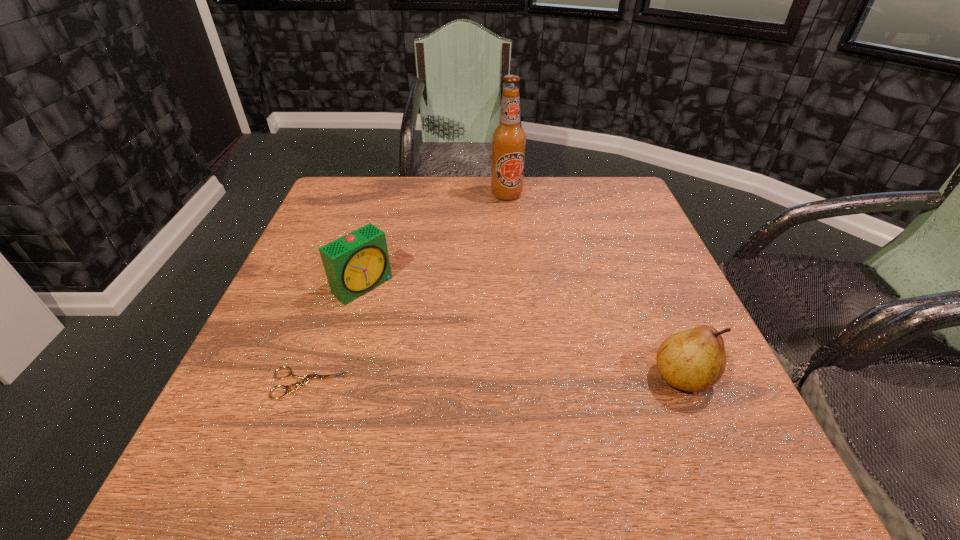
At what (x,y) coordinates should I click in order to perform the action: click on vacant area situated 0.230m on the front-facing side of the alarm clock. Please return your answer as a coordinate pair (x, y). Looking at the image, I should click on (453, 357).

In order to click on free space located 0.050m on the front-facing side of the alarm clock in this screenshot , I will do `click(394, 310)`.

Image resolution: width=960 pixels, height=540 pixels. In order to click on vacant space located 0.210m on the front-facing side of the alarm clock in this screenshot , I will do `click(446, 352)`.

Find the location of `object that is at the far edge`. object that is at the far edge is located at coordinates (508, 139).

Identify the location of shears present at the near edge. (305, 379).

Locate an element on the screen. The width and height of the screenshot is (960, 540). pear positioned at the near edge is located at coordinates (693, 360).

The height and width of the screenshot is (540, 960). What are the coordinates of `shears that is at the left edge` in the screenshot? It's located at (305, 379).

Where is `alarm clock that is at the left edge`? alarm clock that is at the left edge is located at coordinates (356, 263).

Find the location of a particular element. The height and width of the screenshot is (540, 960). object at the right edge is located at coordinates (693, 360).

Find the location of `object that is at the near left corner`. object that is at the near left corner is located at coordinates (305, 379).